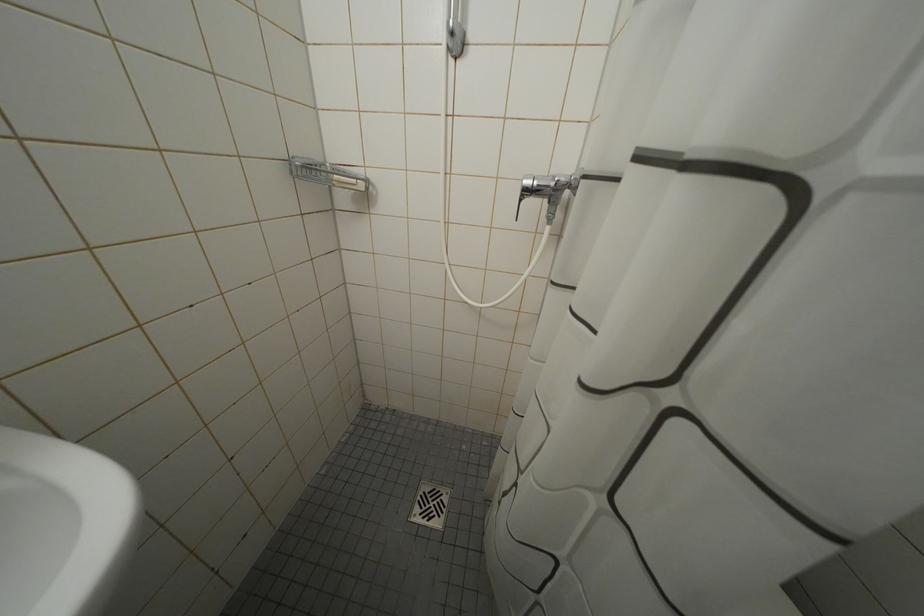
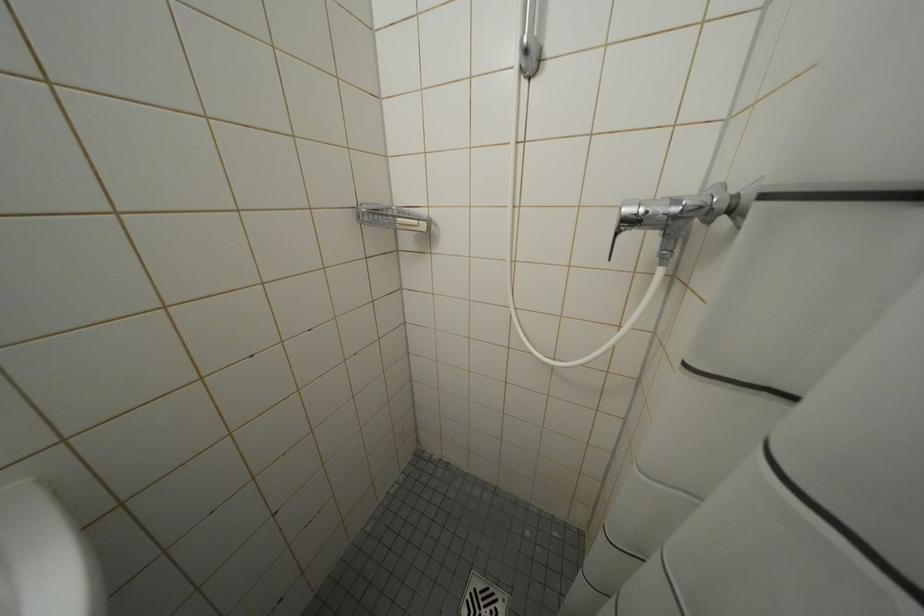
Question: Which direction would the cameraman need to move to produce the second image? Reply with the corresponding letter.

Choices:
 (A) Left
 (B) Right
 (C) Forward
 (D) Backward

Answer: (C)